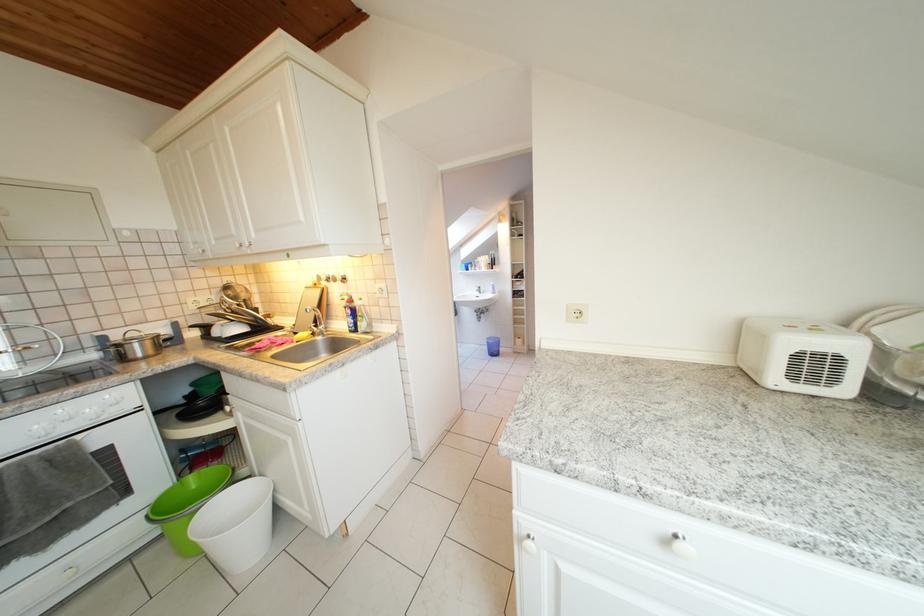
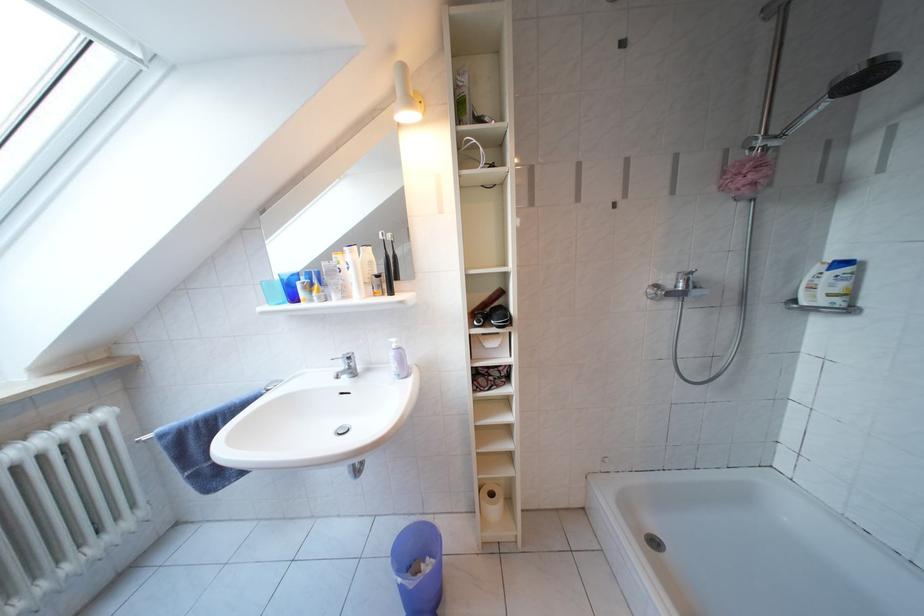
The point at (499,347) is marked in the first image. Where is the corresponding point in the second image?

(419, 589)